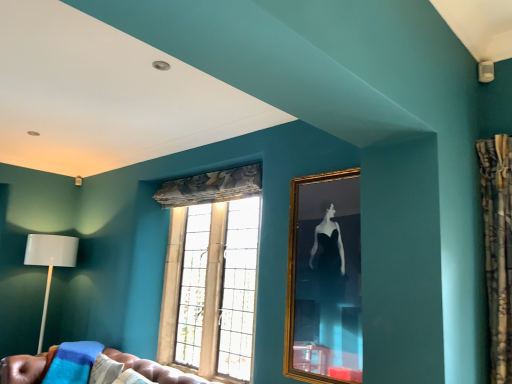
Locate an element on the screen. Image resolution: width=512 pixels, height=384 pixels. leather tufted couch at lower left is located at coordinates (154, 369).

The width and height of the screenshot is (512, 384). What do you see at coordinates (324, 280) in the screenshot?
I see `gold-framed mirror at center-right` at bounding box center [324, 280].

This screenshot has width=512, height=384. I want to click on leather tufted couch at lower left, so click(x=154, y=369).

Is point (42, 250) closer or farther from the camera than point (200, 362)?

Clearly, point (42, 250) is more distant from the camera than point (200, 362).

From a real-world perspective, which is physically above, white matte floor lamp at left or stained glass window at center?

stained glass window at center is physically above.

Is the surface of white matte floor lamp at left in direct contact with stained glass window at center?

They are not placed beside each other.

Image resolution: width=512 pixels, height=384 pixels. I want to click on table lamp that is on the left side of stained glass window at center, so click(x=50, y=262).

Measure the distance between leather tufted couch at lower left and stained glass window at center.

They are 85.03 centimeters apart.

Is leather tufted couch at lower left beside stained glass window at center?

No, leather tufted couch at lower left is not making contact with stained glass window at center.

Based on the photo, which object is positioned more to the right, leather tufted couch at lower left or stained glass window at center?

Positioned to the right is stained glass window at center.

Is leather tufted couch at lower left shorter than stained glass window at center?

Indeed, leather tufted couch at lower left has a lesser height compared to stained glass window at center.

From the image's perspective, which is below, stained glass window at center or leather tufted couch at lower left?

leather tufted couch at lower left is shown below in the image.

Can you confirm if stained glass window at center is taller than leather tufted couch at lower left?

Correct, stained glass window at center is much taller as leather tufted couch at lower left.

Is stained glass window at center placed right next to leather tufted couch at lower left?

They are not placed beside each other.

Identify the location of studio couch on the left of the stained glass window at center. (154, 369).

Which object is wider, gold-framed mirror at center-right or white matte floor lamp at left?

white matte floor lamp at left.

Considering the positions of point (290, 311) and point (52, 268), is point (290, 311) closer or farther from the camera than point (52, 268)?

Point (290, 311) is closer to the camera than point (52, 268).

Could you tell me if gold-framed mirror at center-right is turned towards white matte floor lamp at left?

No.

Considering the sizes of objects gold-framed mirror at center-right and white matte floor lamp at left in the image provided, who is bigger, gold-framed mirror at center-right or white matte floor lamp at left?

white matte floor lamp at left.

Is stained glass window at center looking in the opposite direction of gold-framed mirror at center-right?

No, stained glass window at center is not facing away from gold-framed mirror at center-right.

Considering the sizes of objects stained glass window at center and gold-framed mirror at center-right in the image provided, who is bigger, stained glass window at center or gold-framed mirror at center-right?

stained glass window at center is bigger.

From the image's perspective, is stained glass window at center below gold-framed mirror at center-right?

Yes, from the image's perspective, stained glass window at center is beneath gold-framed mirror at center-right.

From a real-world perspective, which object rests below the other?

stained glass window at center, from a real-world perspective.

From a real-world perspective, is gold-framed mirror at center-right positioned above or below stained glass window at center?

Clearly, from a real-world perspective, gold-framed mirror at center-right is above stained glass window at center.

Where is `window located below the gold-framed mirror at center-right (from the image's perspective)`? The height and width of the screenshot is (384, 512). window located below the gold-framed mirror at center-right (from the image's perspective) is located at coordinates point(212,275).

Which of these two, gold-framed mirror at center-right or stained glass window at center, is wider?

stained glass window at center.

Is stained glass window at center at the back of gold-framed mirror at center-right?

No.

Is leather tufted couch at lower left wider or thinner than gold-framed mirror at center-right?

Considering their sizes, leather tufted couch at lower left looks broader than gold-framed mirror at center-right.

Locate an element on the screen. This screenshot has width=512, height=384. studio couch lying on the left of gold-framed mirror at center-right is located at coordinates (154, 369).

Can you tell me how much leather tufted couch at lower left and gold-framed mirror at center-right differ in facing direction?

leather tufted couch at lower left and gold-framed mirror at center-right are facing 1.63 degrees away from each other.

In terms of height, does leather tufted couch at lower left look taller or shorter compared to gold-framed mirror at center-right?

Considering their sizes, leather tufted couch at lower left has less height than gold-framed mirror at center-right.

Find the location of `table lamp that is under the stained glass window at center (from a real-world perspective)`. table lamp that is under the stained glass window at center (from a real-world perspective) is located at coordinates (50, 262).

Locate an element on the screen. studio couch below the stained glass window at center (from the image's perspective) is located at coordinates point(154,369).

From the image, which object appears to be nearer to gold-framed mirror at center-right, leather tufted couch at lower left or white matte floor lamp at left?

leather tufted couch at lower left lies closer to gold-framed mirror at center-right than the other object.

In the scene shown: Based on their spatial positions, is stained glass window at center or white matte floor lamp at left further from gold-framed mirror at center-right?

white matte floor lamp at left lies further to gold-framed mirror at center-right than the other object.

Which object lies further to the anchor point leather tufted couch at lower left, gold-framed mirror at center-right or white matte floor lamp at left?

white matte floor lamp at left is further to leather tufted couch at lower left.

Consider the image. When comparing their distances from stained glass window at center, does gold-framed mirror at center-right or white matte floor lamp at left seem closer?

The object closer to stained glass window at center is gold-framed mirror at center-right.

Which object lies nearer to the anchor point gold-framed mirror at center-right, white matte floor lamp at left or leather tufted couch at lower left?

Based on the image, leather tufted couch at lower left appears to be nearer to gold-framed mirror at center-right.

Based on their spatial positions, is gold-framed mirror at center-right or leather tufted couch at lower left further from white matte floor lamp at left?

gold-framed mirror at center-right.

Which object lies nearer to the anchor point stained glass window at center, gold-framed mirror at center-right or leather tufted couch at lower left?

The object closer to stained glass window at center is leather tufted couch at lower left.

Based on their spatial positions, is gold-framed mirror at center-right or stained glass window at center further from white matte floor lamp at left?

gold-framed mirror at center-right is positioned further to the anchor white matte floor lamp at left.

I want to click on studio couch between white matte floor lamp at left and gold-framed mirror at center-right from left to right, so click(x=154, y=369).

This screenshot has width=512, height=384. I want to click on window located between leather tufted couch at lower left and gold-framed mirror at center-right in the left-right direction, so click(x=212, y=275).

This screenshot has width=512, height=384. In order to click on window located between white matte floor lamp at left and gold-framed mirror at center-right in the left-right direction in this screenshot , I will do `click(212, 275)`.

I want to click on window located between leather tufted couch at lower left and white matte floor lamp at left in the depth direction, so click(212, 275).